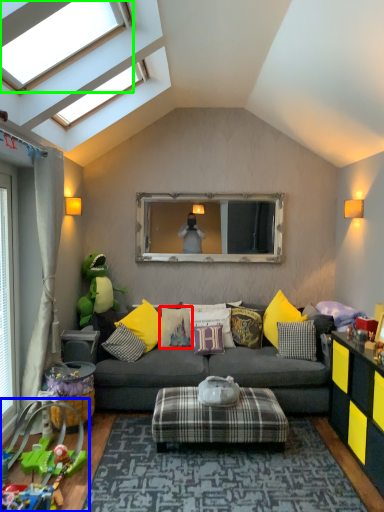
Question: Which object is positioned closest to pillow (highlighted by a red box)? Select from toy (highlighted by a blue box) and window (highlighted by a green box).

Choices:
 (A) toy
 (B) window

Answer: (A)